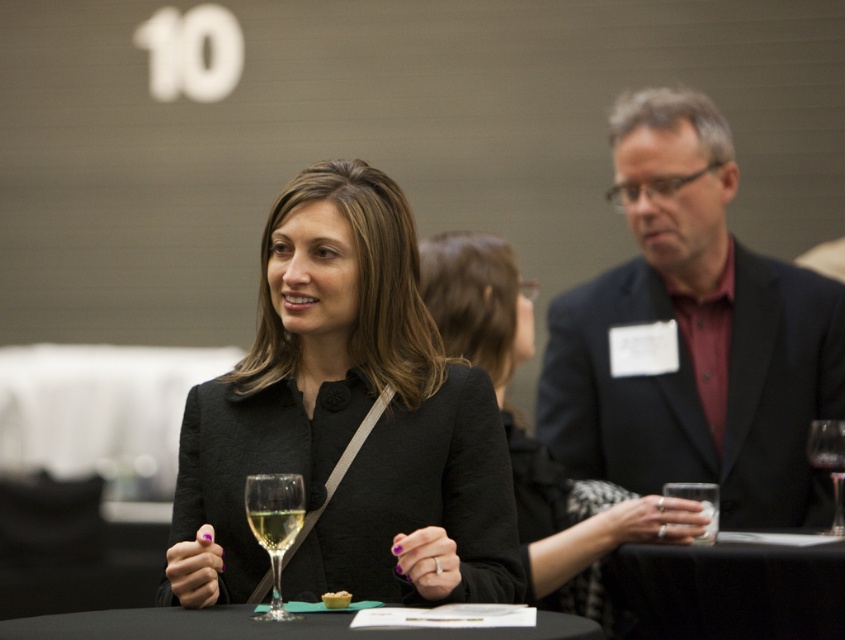
You are a bartender at the event and need to place a napkin under the clear glass wine glass at center and the clear glass wine at center. Which one requires a larger napkin to cover its base?

The clear glass wine glass at center requires a larger napkin because its width is greater than the clear glass wine at center.